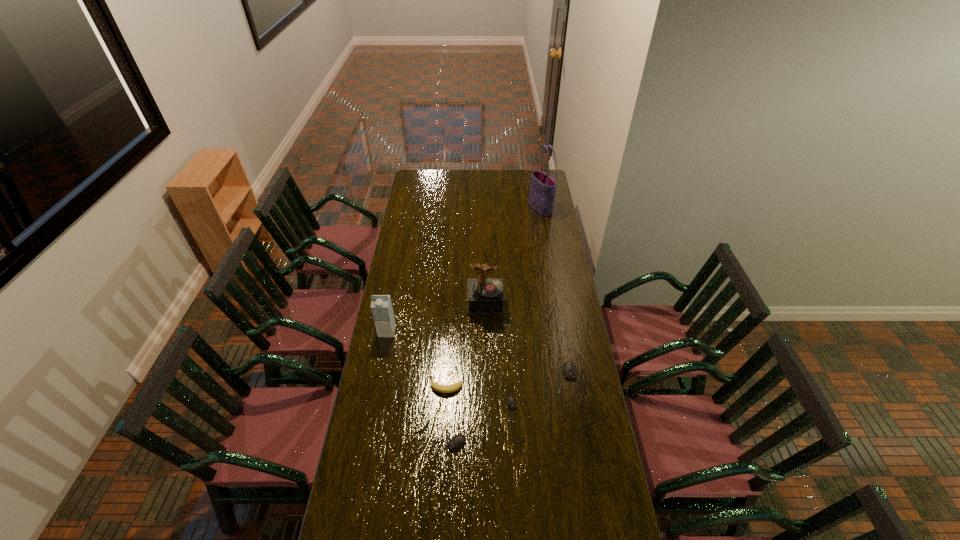
You are a GUI agent. You are given a task and a screenshot of the screen. Output one action in this format:
    pyautogui.click(x=<x>, y=<y>)
    Task: Click on the nearest mouse
    Image resolution: width=960 pixels, height=540 pixels.
    Given the screenshot: What is the action you would take?
    pyautogui.click(x=456, y=441)

Where is `the nearest object`? the nearest object is located at coordinates (456, 441).

You are a GUI agent. You are given a task and a screenshot of the screen. Output one action in this format:
    pyautogui.click(x=<x>, y=<y>)
    Task: Click on the second nearest mouse
    
    Given the screenshot: What is the action you would take?
    pyautogui.click(x=511, y=403)

This screenshot has height=540, width=960. I want to click on the second mouse from left to right, so pos(511,403).

The height and width of the screenshot is (540, 960). In order to click on the tallest mouse in this screenshot , I will do `click(569, 371)`.

Where is `the rightmost mouse`? Image resolution: width=960 pixels, height=540 pixels. the rightmost mouse is located at coordinates (569, 371).

Locate an element on the screen. The width and height of the screenshot is (960, 540). the fifth shortest object is located at coordinates (381, 306).

Image resolution: width=960 pixels, height=540 pixels. I want to click on the leftmost object, so click(x=381, y=306).

Locate an element on the screen. phonograph_record is located at coordinates (485, 296).

At what (x,y) coordinates should I click in order to perform the action: click on the second tallest object. Please return your answer as a coordinate pair (x, y). The width and height of the screenshot is (960, 540). Looking at the image, I should click on (485, 296).